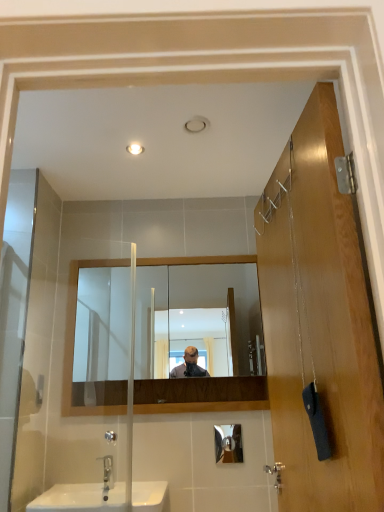
In order to face wooden door at right, should I rotate leftwards or rightwards?

A 13.233 degree turn to the right will do.

Describe the element at coordinates (197, 316) in the screenshot. I see `clear glass mirror at center` at that location.

The width and height of the screenshot is (384, 512). I want to click on silver metallic faucet at lower left, so click(x=107, y=472).

I want to click on wooden door at right, so [x=319, y=324].

From a real-world perspective, is silver metallic faucet at lower left above or below wooden door at right?

silver metallic faucet at lower left is below wooden door at right.

Would you say wooden door at right is part of silver metallic faucet at lower left's contents?

That's incorrect, wooden door at right is not inside silver metallic faucet at lower left.

Is there a large distance between silver metallic faucet at lower left and wooden door at right?

Yes.

Is white glossy sink at lower left completely or partially inside wooden door at right?

No.

Which object is wider, wooden door at right or white glossy sink at lower left?

Wider between the two is white glossy sink at lower left.

How much distance is there between wooden door at right and white glossy sink at lower left?

→ The distance of wooden door at right from white glossy sink at lower left is 1.12 meters.

In the scene shown: Between wooden door at right and white glossy sink at lower left, which one is positioned behind?

Positioned behind is white glossy sink at lower left.

Is clear glass mirror at center not near silver metallic faucet at lower left?

Actually, clear glass mirror at center and silver metallic faucet at lower left are a little close together.

Between clear glass mirror at center and silver metallic faucet at lower left, which one has less height?

With less height is silver metallic faucet at lower left.

This screenshot has width=384, height=512. In order to click on tap in front of the clear glass mirror at center in this screenshot , I will do tap(107, 472).

Which point is more forward, (94, 269) or (107, 476)?

The point (107, 476) is closer to the camera.

Where is `mirror above the wooden door at right (from a real-world perspective)`? This screenshot has width=384, height=512. mirror above the wooden door at right (from a real-world perspective) is located at coordinates (197, 316).

From the image's perspective, which is above, wooden door at right or clear glass mirror at center?

From the image's view, wooden door at right is above.

Is wooden door at right inside or outside of clear glass mirror at center?

wooden door at right cannot be found inside clear glass mirror at center.

Looking at this image, which is closer to the camera, (372, 368) or (257, 315)?

Point (372, 368) is positioned closer to the camera compared to point (257, 315).

Can you tell me how much clear glass mirror at center and white glossy sink at lower left differ in facing direction?

0.287 degrees separate the facing orientations of clear glass mirror at center and white glossy sink at lower left.

Is white glossy sink at lower left inside clear glass mirror at center?

No.

Is clear glass mirror at center to the right of white glossy sink at lower left from the viewer's perspective?

Indeed, clear glass mirror at center is positioned on the right side of white glossy sink at lower left.

From the image's perspective, does clear glass mirror at center appear higher than white glossy sink at lower left?

Yes.

Which of these two, clear glass mirror at center or wooden door at right, is bigger?

wooden door at right is bigger.

Between clear glass mirror at center and wooden door at right, which one has less height?

With less height is clear glass mirror at center.

From a real-world perspective, between clear glass mirror at center and wooden door at right, who is vertically higher?

clear glass mirror at center, from a real-world perspective.

Is wooden door at right surrounded by clear glass mirror at center?

Definitely not — wooden door at right is not inside clear glass mirror at center.

Is point (289, 323) positioned before point (106, 486)?

That is True.

Is wooden door at right thinner than silver metallic faucet at lower left?

Yes, wooden door at right is thinner than silver metallic faucet at lower left.

From a real-world perspective, between wooden door at right and silver metallic faucet at lower left, who is vertically lower?

silver metallic faucet at lower left.

Can silver metallic faucet at lower left be found inside wooden door at right?

No, silver metallic faucet at lower left is located outside of wooden door at right.

The image size is (384, 512). I want to click on door that is above the silver metallic faucet at lower left (from the image's perspective), so click(x=319, y=324).

The image size is (384, 512). I want to click on sink behind the wooden door at right, so click(101, 497).

Looking at this image, when comparing their distances from silver metallic faucet at lower left, does wooden door at right or white glossy sink at lower left seem further?

The object further to silver metallic faucet at lower left is wooden door at right.

Which object lies nearer to the anchor point silver metallic faucet at lower left, clear glass mirror at center or wooden door at right?

Based on the image, clear glass mirror at center appears to be nearer to silver metallic faucet at lower left.

From the picture: Looking at the image, which one is located further to wooden door at right, clear glass mirror at center or silver metallic faucet at lower left?

silver metallic faucet at lower left lies further to wooden door at right than the other object.

When comparing their distances from silver metallic faucet at lower left, does white glossy sink at lower left or clear glass mirror at center seem closer?

white glossy sink at lower left is closer to silver metallic faucet at lower left.

Which object lies further to the anchor point silver metallic faucet at lower left, white glossy sink at lower left or wooden door at right?

wooden door at right.

From the image, which object appears to be nearer to clear glass mirror at center, wooden door at right or silver metallic faucet at lower left?

silver metallic faucet at lower left lies closer to clear glass mirror at center than the other object.

Based on their spatial positions, is clear glass mirror at center or wooden door at right further from white glossy sink at lower left?

wooden door at right is further to white glossy sink at lower left.

From the image, which object appears to be farther from white glossy sink at lower left, clear glass mirror at center or silver metallic faucet at lower left?

clear glass mirror at center is positioned further to the anchor white glossy sink at lower left.

At what (x,y) coordinates should I click in order to perform the action: click on sink located between wooden door at right and silver metallic faucet at lower left in the depth direction. Please return your answer as a coordinate pair (x, y). Looking at the image, I should click on coord(101,497).

Image resolution: width=384 pixels, height=512 pixels. Identify the location of tap that lies between clear glass mirror at center and white glossy sink at lower left from top to bottom. (107, 472).

In order to click on tap between wooden door at right and clear glass mirror at center from front to back in this screenshot , I will do `click(107, 472)`.

At what (x,y) coordinates should I click in order to perform the action: click on sink positioned between wooden door at right and clear glass mirror at center from near to far. Please return your answer as a coordinate pair (x, y). The height and width of the screenshot is (512, 384). Looking at the image, I should click on (101, 497).